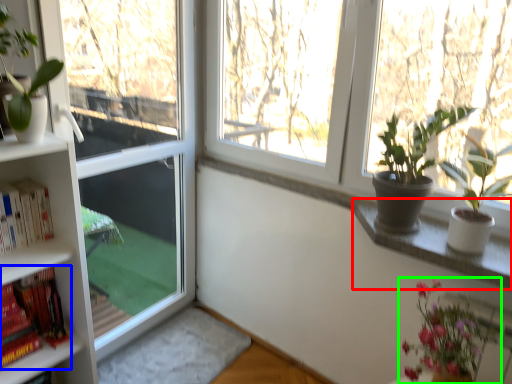
Question: Considering the real-world distances, which object is farthest from window sill (highlighted by a red box)? book (highlighted by a blue box) or houseplant (highlighted by a green box)?

Choices:
 (A) book
 (B) houseplant

Answer: (A)